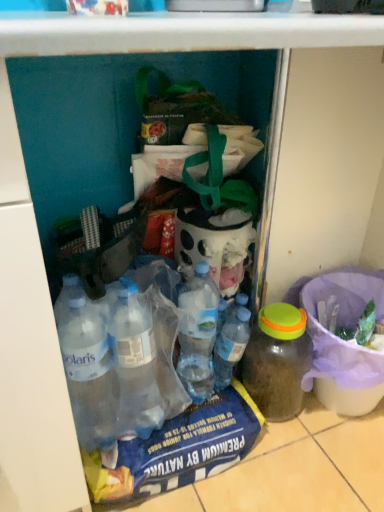
Find the location of a particular element. This screenshot has height=512, width=384. transparent plastic bottle at center, which is the first bottle from left to right is located at coordinates (230, 347).

Image resolution: width=384 pixels, height=512 pixels. Describe the element at coordinates (277, 361) in the screenshot. I see `translucent plastic jar at lower right, arranged as the 2th bottle when viewed from the left` at that location.

Find the location of a particular element. translucent plastic bucket at lower right is located at coordinates (344, 344).

Are translucent plastic bucket at lower right and translucent plastic jar at lower right, arranged as the 2th bottle when viewed from the left, located far from each other?

No.

Is translucent plastic bucket at lower right oriented towards translucent plastic jar at lower right, arranged as the 2th bottle when viewed from the left?

No, translucent plastic bucket at lower right is not turned towards translucent plastic jar at lower right, arranged as the 2th bottle when viewed from the left.

Which object is more forward, translucent plastic bucket at lower right or translucent plastic jar at lower right, arranged as the 2th bottle when viewed from the left?

translucent plastic bucket at lower right is closer to the camera.

Considering the relative sizes of translucent plastic bucket at lower right and translucent plastic jar at lower right, arranged as the 2th bottle when viewed from the left, in the image provided, is translucent plastic bucket at lower right wider than translucent plastic jar at lower right, arranged as the 2th bottle when viewed from the left,?

Yes, translucent plastic bucket at lower right is wider than translucent plastic jar at lower right, arranged as the 2th bottle when viewed from the left.

Considering the sizes of objects translucent plastic jar at lower right, which appears as the 1th bottle when viewed from the right, and transparent plastic bottle at center, which is the first bottle from left to right, in the image provided, who is shorter, translucent plastic jar at lower right, which appears as the 1th bottle when viewed from the right, or transparent plastic bottle at center, which is the first bottle from left to right,?

transparent plastic bottle at center, which is the first bottle from left to right, is shorter.

How many degrees apart are the facing directions of translucent plastic jar at lower right, which appears as the 1th bottle when viewed from the right, and transparent plastic bottle at center, which appears as the second bottle when viewed from the right?

The angular difference between translucent plastic jar at lower right, which appears as the 1th bottle when viewed from the right, and transparent plastic bottle at center, which appears as the second bottle when viewed from the right, is 1.74 degrees.

From the image's perspective, between translucent plastic jar at lower right, arranged as the 2th bottle when viewed from the left, and transparent plastic bottle at center, which is the first bottle from left to right, who is located below?

translucent plastic jar at lower right, arranged as the 2th bottle when viewed from the left, is shown below in the image.

Does point (302, 353) lie in front of point (227, 382)?

No, it is not.

Which is correct: transparent plastic bottle at center, which is the first bottle from left to right, is inside translucent plastic bucket at lower right, or outside of it?

transparent plastic bottle at center, which is the first bottle from left to right, is not inside translucent plastic bucket at lower right, it's outside.

The image size is (384, 512). Identify the location of bottle above the translucent plastic bucket at lower right (from the image's perspective). (230, 347).

Would you say transparent plastic bottle at center, which appears as the second bottle when viewed from the right, is to the left or to the right of translucent plastic bucket at lower right in the picture?

transparent plastic bottle at center, which appears as the second bottle when viewed from the right, is to the left of translucent plastic bucket at lower right.

From a real-world perspective, which is physically below, transparent plastic bottle at center, which appears as the second bottle when viewed from the right, or translucent plastic jar at lower right, which appears as the 1th bottle when viewed from the right?

translucent plastic jar at lower right, which appears as the 1th bottle when viewed from the right.

Locate an element on the screen. The image size is (384, 512). bottle below the transparent plastic bottle at center, which is the first bottle from left to right (from a real-world perspective) is located at coordinates (277, 361).

Could you measure the distance between transparent plastic bottle at center, which appears as the second bottle when viewed from the right, and translucent plastic jar at lower right, which appears as the 1th bottle when viewed from the right?

transparent plastic bottle at center, which appears as the second bottle when viewed from the right, is 3.66 inches away from translucent plastic jar at lower right, which appears as the 1th bottle when viewed from the right.

Is there a large distance between transparent plastic bottle at center, which appears as the second bottle when viewed from the right, and translucent plastic jar at lower right, which appears as the 1th bottle when viewed from the right?

No.

Between translucent plastic bucket at lower right and transparent plastic bottle at center, which appears as the second bottle when viewed from the right, which one has less height?

Standing shorter between the two is transparent plastic bottle at center, which appears as the second bottle when viewed from the right.

In the scene shown: Between translucent plastic bucket at lower right and transparent plastic bottle at center, which is the first bottle from left to right, which one has larger width?

Wider between the two is translucent plastic bucket at lower right.

From the image's perspective, between translucent plastic bucket at lower right and transparent plastic bottle at center, which appears as the second bottle when viewed from the right, who is located below?

translucent plastic bucket at lower right is shown below in the image.

Is translucent plastic bucket at lower right in front of or behind transparent plastic bottle at center, which is the first bottle from left to right, in the image?

translucent plastic bucket at lower right is positioned closer to the viewer than transparent plastic bottle at center, which is the first bottle from left to right.

Considering the sizes of objects translucent plastic jar at lower right, which appears as the 1th bottle when viewed from the right, and translucent plastic bucket at lower right in the image provided, who is wider, translucent plastic jar at lower right, which appears as the 1th bottle when viewed from the right, or translucent plastic bucket at lower right?

Wider between the two is translucent plastic bucket at lower right.

In terms of size, does translucent plastic jar at lower right, which appears as the 1th bottle when viewed from the right, appear bigger or smaller than translucent plastic bucket at lower right?

In the image, translucent plastic jar at lower right, which appears as the 1th bottle when viewed from the right, appears to be smaller than translucent plastic bucket at lower right.

Considering the points (293, 408) and (344, 371), which point is in front, point (293, 408) or point (344, 371)?

The point (344, 371) is closer.

From the image's perspective, is translucent plastic jar at lower right, which appears as the 1th bottle when viewed from the right, beneath translucent plastic bucket at lower right?

Correct, translucent plastic jar at lower right, which appears as the 1th bottle when viewed from the right, appears lower than translucent plastic bucket at lower right in the image.

From the translucent plastic bucket at lower right, count 1st bottles backward and point to it. Please provide its 2D coordinates.

[(277, 361)]

The height and width of the screenshot is (512, 384). I want to click on bottle above the translucent plastic jar at lower right, arranged as the 2th bottle when viewed from the left (from the image's perspective), so click(230, 347).

Based on the photo, looking at the image, which one is located further to translucent plastic jar at lower right, arranged as the 2th bottle when viewed from the left, transparent plastic bottle at center, which appears as the second bottle when viewed from the right, or translucent plastic bucket at lower right?

translucent plastic bucket at lower right lies further to translucent plastic jar at lower right, arranged as the 2th bottle when viewed from the left, than the other object.

Based on their spatial positions, is transparent plastic bottle at center, which appears as the second bottle when viewed from the right, or translucent plastic jar at lower right, arranged as the 2th bottle when viewed from the left, closer to translucent plastic bucket at lower right?

translucent plastic jar at lower right, arranged as the 2th bottle when viewed from the left, is closer to translucent plastic bucket at lower right.

When comparing their distances from translucent plastic jar at lower right, which appears as the 1th bottle when viewed from the right, does translucent plastic bucket at lower right or transparent plastic bottle at center, which is the first bottle from left to right, seem further?

translucent plastic bucket at lower right lies further to translucent plastic jar at lower right, which appears as the 1th bottle when viewed from the right, than the other object.

Which object lies further to the anchor point transparent plastic bottle at center, which appears as the second bottle when viewed from the right, translucent plastic jar at lower right, which appears as the 1th bottle when viewed from the right, or translucent plastic bucket at lower right?

Among the two, translucent plastic bucket at lower right is located further to transparent plastic bottle at center, which appears as the second bottle when viewed from the right.

From the image, which object appears to be nearer to transparent plastic bottle at center, which appears as the second bottle when viewed from the right, translucent plastic bucket at lower right or translucent plastic jar at lower right, which appears as the 1th bottle when viewed from the right?

translucent plastic jar at lower right, which appears as the 1th bottle when viewed from the right, is closer to transparent plastic bottle at center, which appears as the second bottle when viewed from the right.

When comparing their distances from translucent plastic bucket at lower right, does translucent plastic jar at lower right, which appears as the 1th bottle when viewed from the right, or transparent plastic bottle at center, which is the first bottle from left to right, seem closer?

Based on the image, translucent plastic jar at lower right, which appears as the 1th bottle when viewed from the right, appears to be nearer to translucent plastic bucket at lower right.

You are a GUI agent. You are given a task and a screenshot of the screen. Output one action in this format:
    pyautogui.click(x=<x>, y=<y>)
    Task: Click on the bottle located between transparent plastic bottle at center, which is the first bottle from left to right, and translucent plastic bucket at lower right in the left-right direction
    
    Given the screenshot: What is the action you would take?
    pyautogui.click(x=277, y=361)